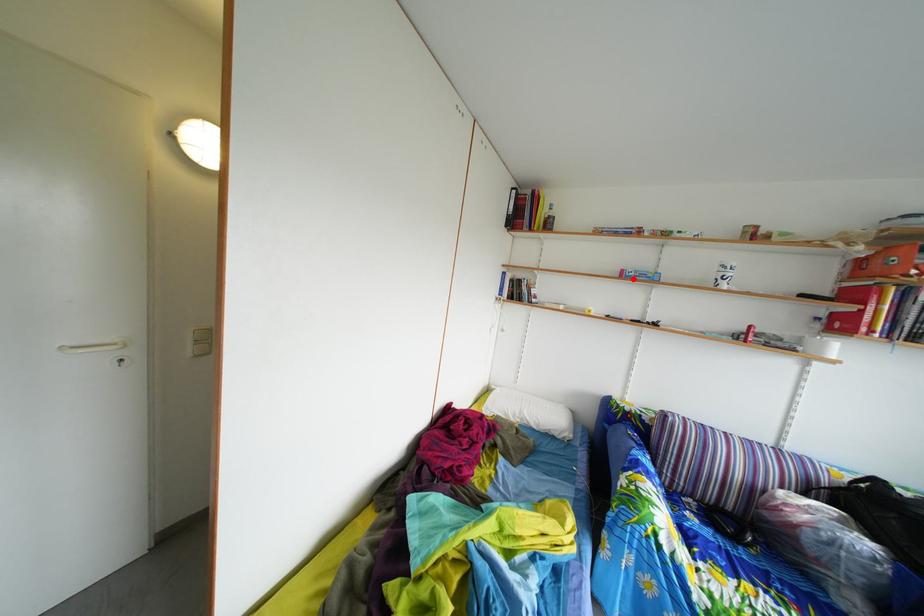
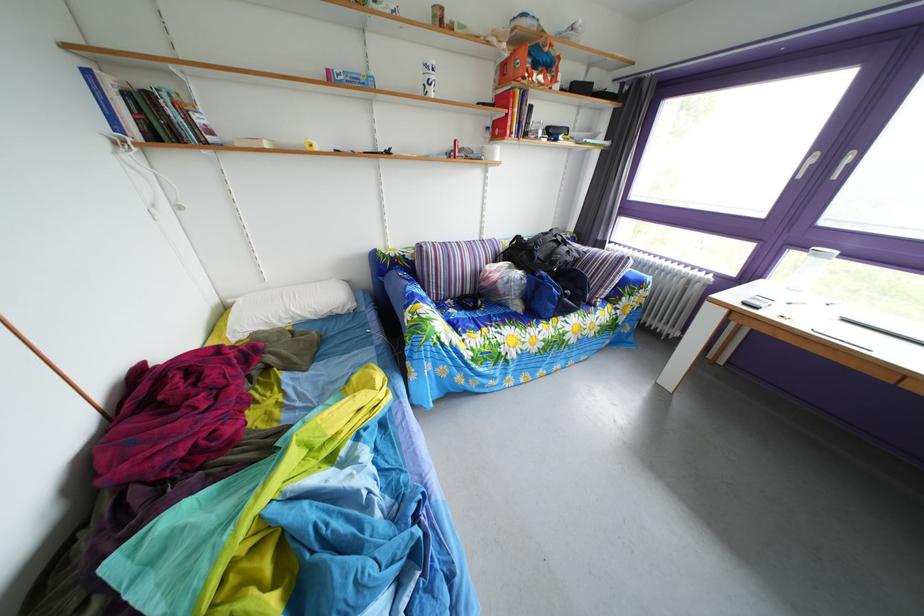
Find the pixel in the second image that matches the highlighted location in the first image.

(339, 79)